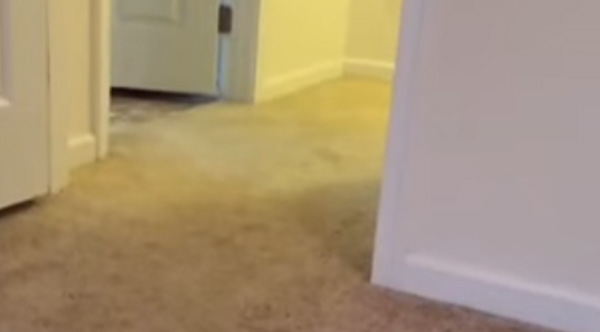
The image size is (600, 332). I want to click on hallway, so click(x=352, y=102).